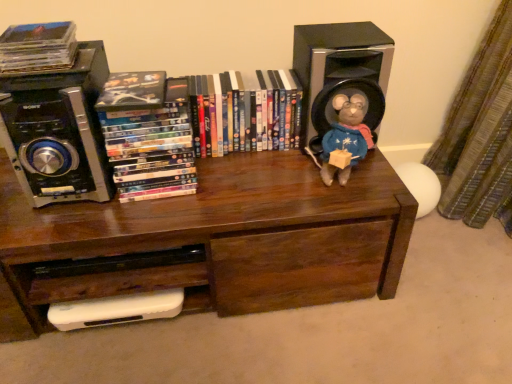
Locate an element on the screen. The image size is (512, 384). free point to the right of fuzzy fabric stuffed animal at upper right is located at coordinates (381, 173).